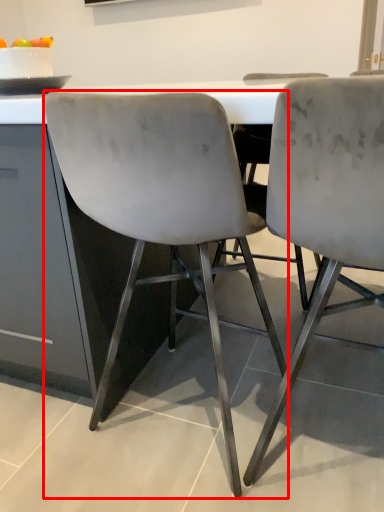
Question: From the image's perspective, considering the relative positions of chair (annotated by the red box) and chair in the image provided, where is chair (annotated by the red box) located with respect to the staircase?

Choices:
 (A) above
 (B) below

Answer: (A)